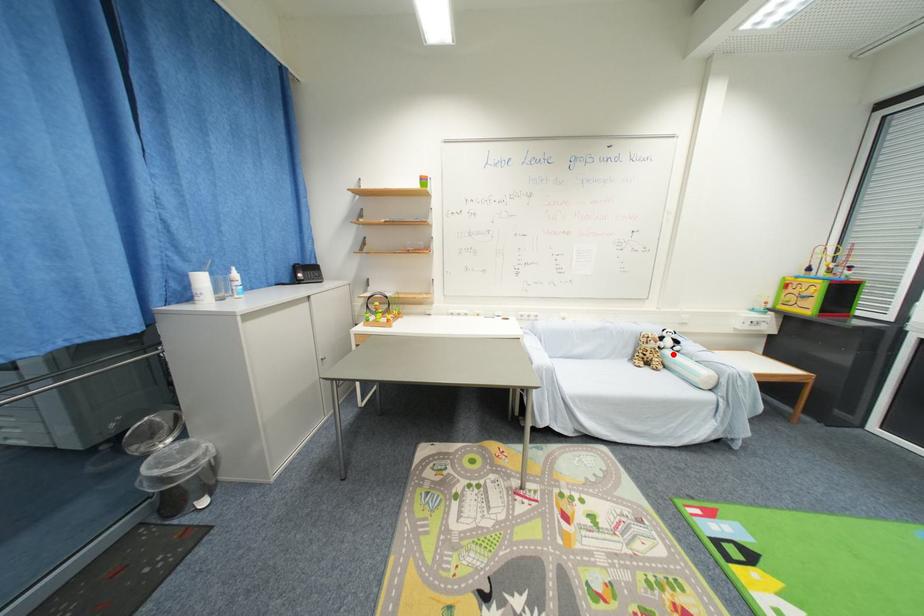
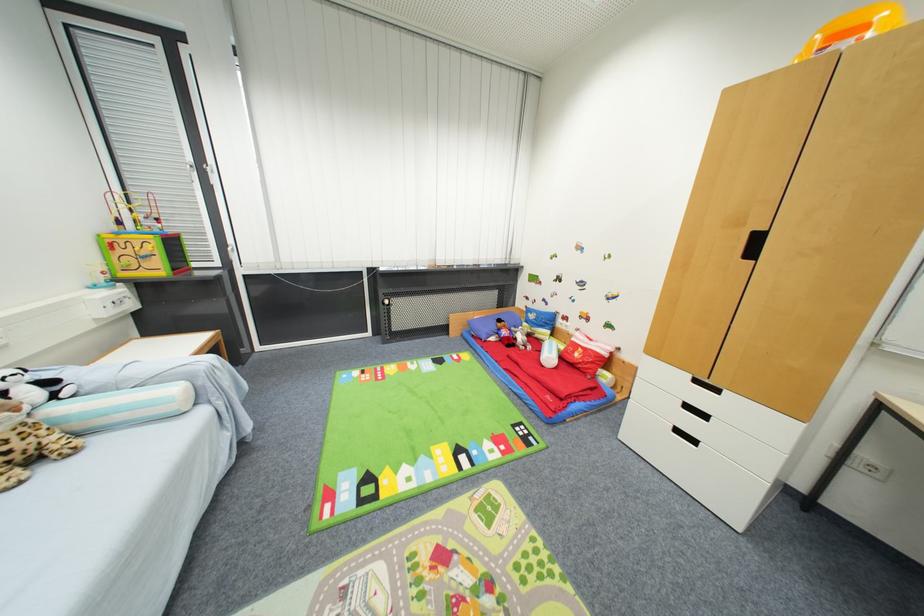
The point at the highlighted location is marked in the first image. Where is the corresponding point in the second image?

(64, 411)